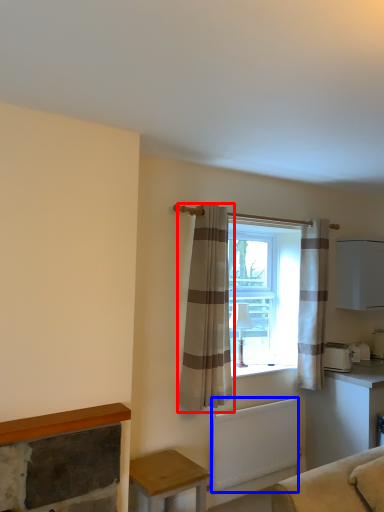
Question: Among these objects, which one is farthest to the camera, curtain (highlighted by a red box) or radiator (highlighted by a blue box)?

Choices:
 (A) curtain
 (B) radiator

Answer: (B)